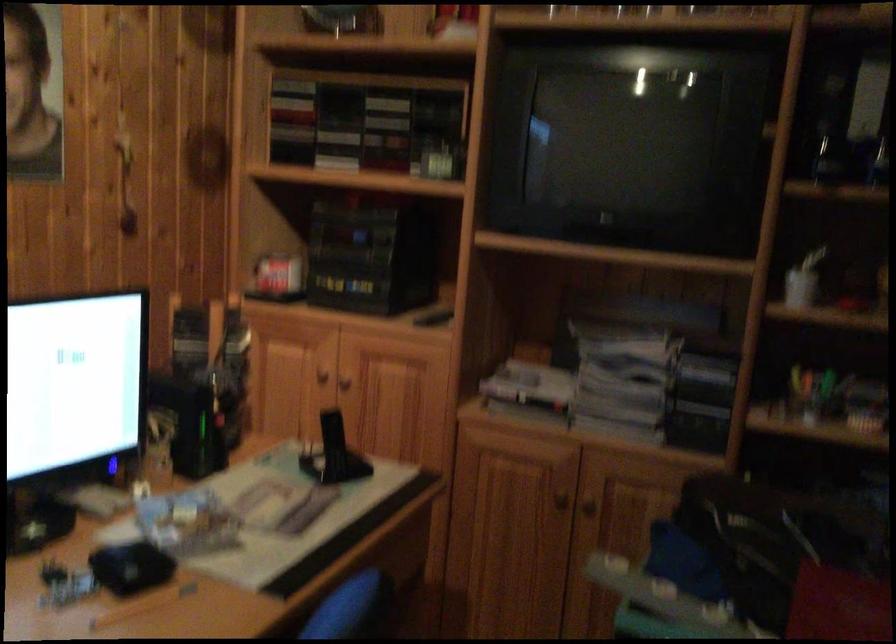
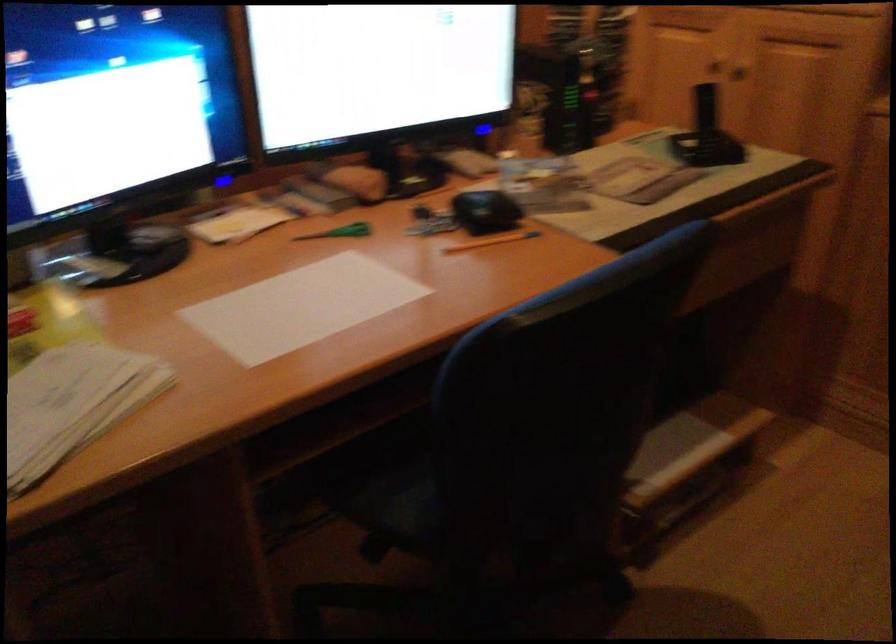
Where in the second image is the point corresponding to (x=343, y=451) from the first image?

(705, 135)